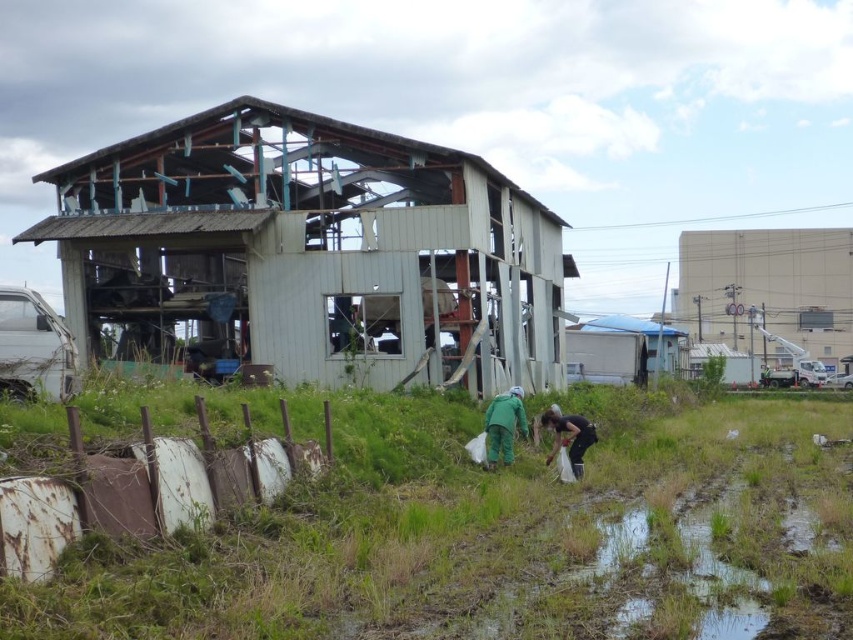
Between green grass at lower center and white concrete building at upper right, which one has less height?

With less height is green grass at lower center.

Between point (265, 580) and point (796, 340), which one is positioned in front?

Point (265, 580) is more forward.

Identify the location of green grass at lower center. The width and height of the screenshot is (853, 640). (482, 532).

How much distance is there between blue tarpaulin hut at right and dark green fabric at lower center?

They are 117.92 feet apart.

Between blue tarpaulin hut at right and dark green fabric at lower center, which one is positioned higher?

blue tarpaulin hut at right is above.

Is point (611, 355) positioned behind point (589, 436)?

That is True.

You are a GUI agent. You are given a task and a screenshot of the screen. Output one action in this format:
    pyautogui.click(x=<x>, y=<y>)
    Task: Click on the blue tarpaulin hut at right
    This screenshot has width=853, height=640.
    Given the screenshot: What is the action you would take?
    pyautogui.click(x=621, y=349)

Between point (490, 554) and point (558, 448), which one is positioned behind?

The point (558, 448) is more distant.

Can you confirm if green grass at lower center is thinner than dark green fabric at lower center?

No.

What do you see at coordinates (482, 532) in the screenshot? This screenshot has height=640, width=853. I see `green grass at lower center` at bounding box center [482, 532].

At what (x,y) coordinates should I click in order to perform the action: click on green grass at lower center. Please return your answer as a coordinate pair (x, y). The height and width of the screenshot is (640, 853). Looking at the image, I should click on (482, 532).